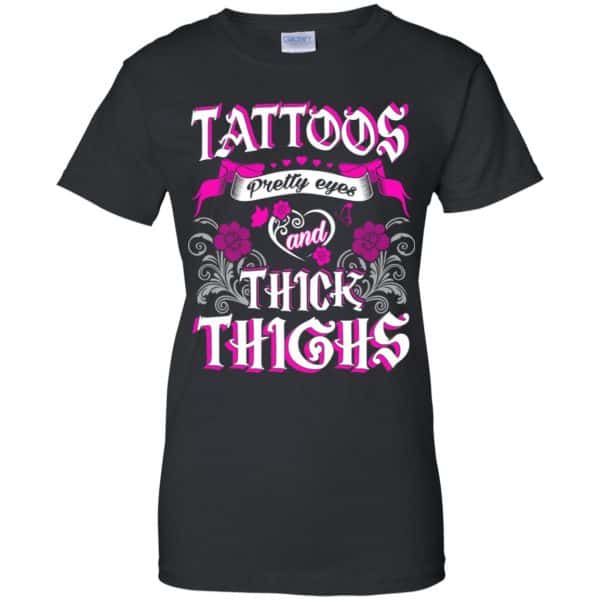
Where is `heart embellishment`? heart embellishment is located at coordinates [x=324, y=214].